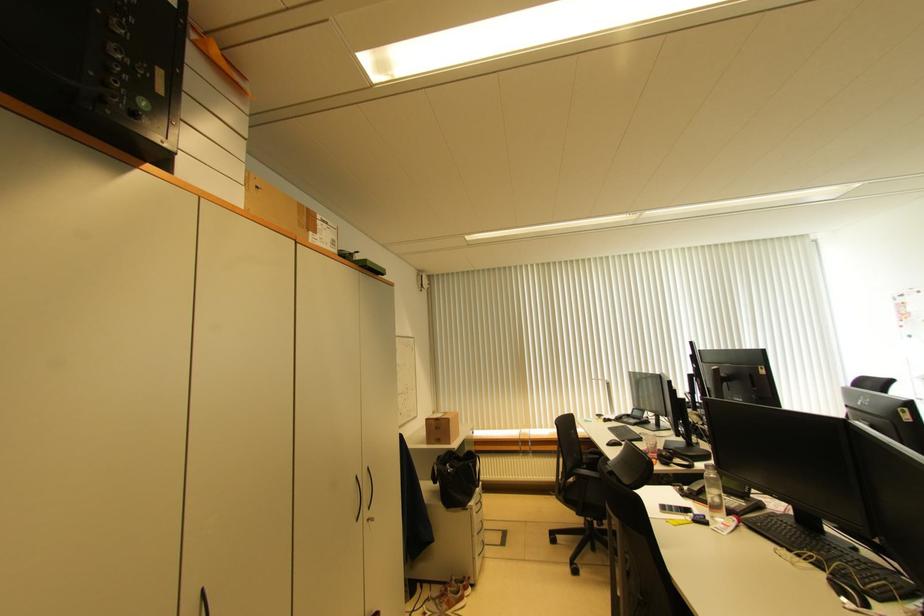
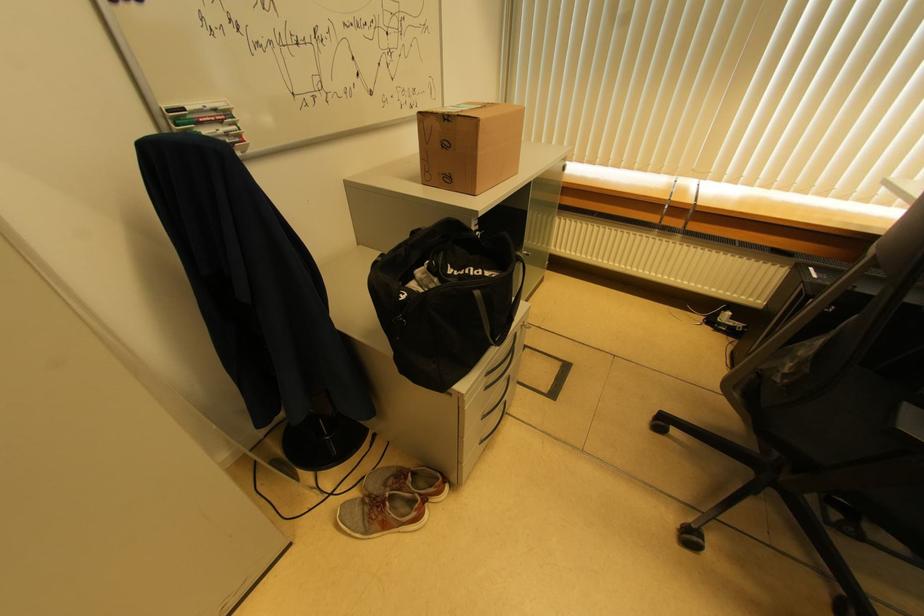
Find the pixel in the second image that matches (x=451, y=422) in the first image.

(477, 124)